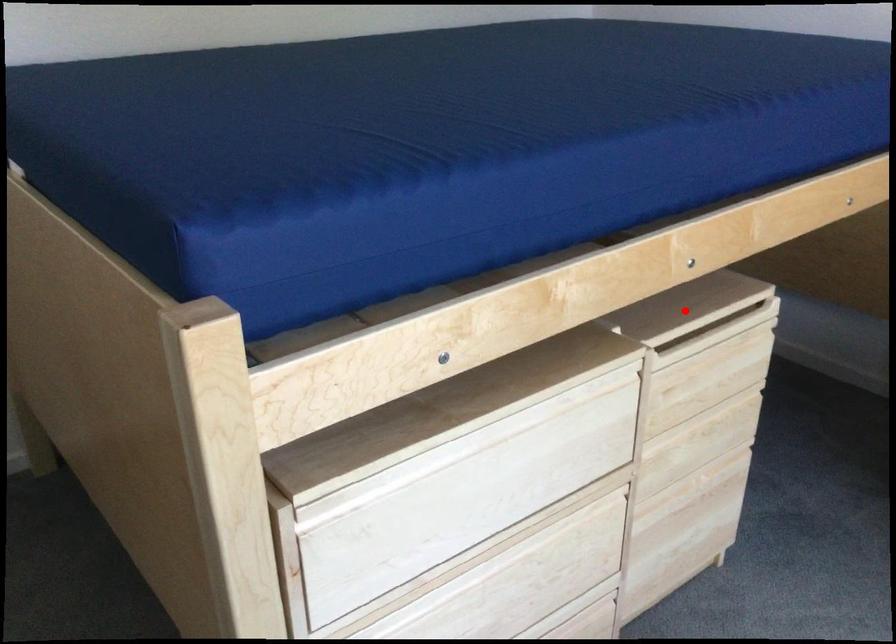
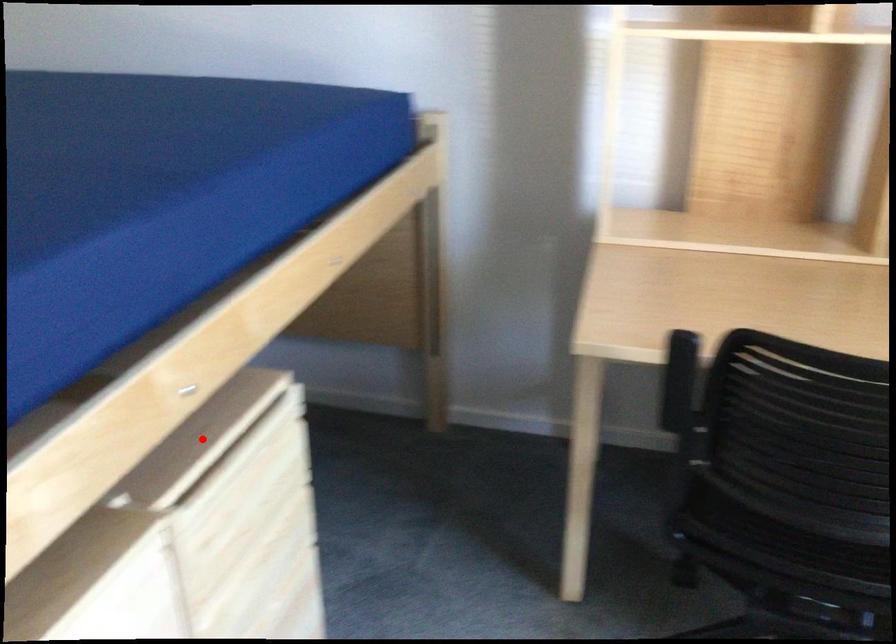
I am providing you with two images of the same scene from different viewpoints. A red point is marked on the first image and another point is marked on the second image. Is the marked point in image1 the same physical position as the marked point in image2?

Yes